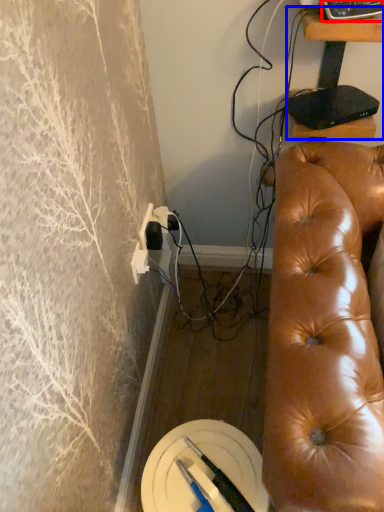
Question: Which object appears farthest to the camera in this image, equipment (highlighted by a red box) or furniture (highlighted by a blue box)?

Choices:
 (A) equipment
 (B) furniture

Answer: (B)